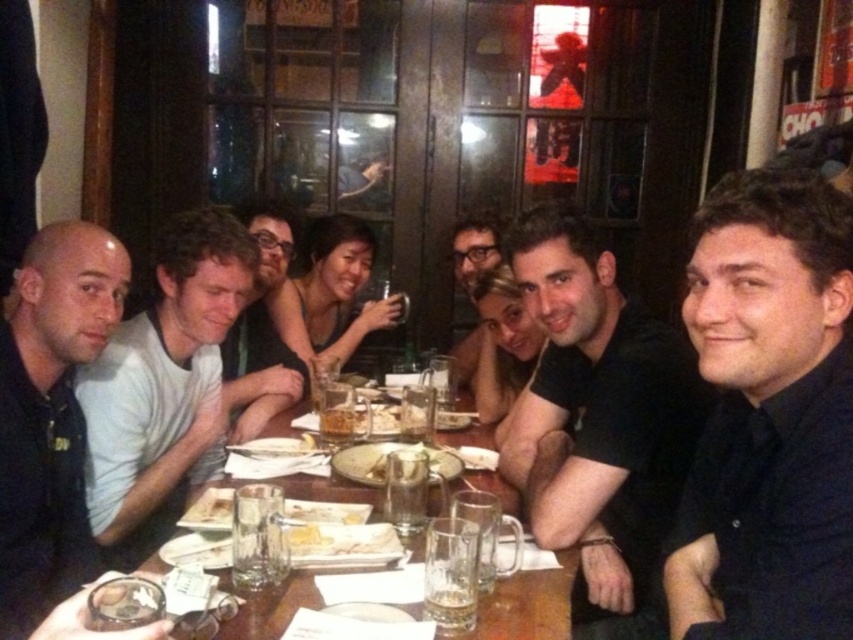
Question: Which of the following is the farthest from the observer?

Choices:
 (A) matte black shirt at center
 (B) wooden table at center

Answer: (A)

Question: Estimate the real-world distances between objects in this image. Which object is farther from the black matte shirt at center?

Choices:
 (A) translucent glass beer at center
 (B) matte black shirt at center

Answer: (B)

Question: Is black matte shirt at left positioned in front of translucent glass beer at center?

Choices:
 (A) yes
 (B) no

Answer: (A)

Question: Does black matte shirt at left appear over white cotton shirt at left?

Choices:
 (A) yes
 (B) no

Answer: (B)

Question: Does wooden table at center come behind translucent glass beer at center?

Choices:
 (A) yes
 (B) no

Answer: (B)

Question: Among these points, which one is farthest from the camera?

Choices:
 (A) (738, 576)
 (B) (422, 596)

Answer: (B)